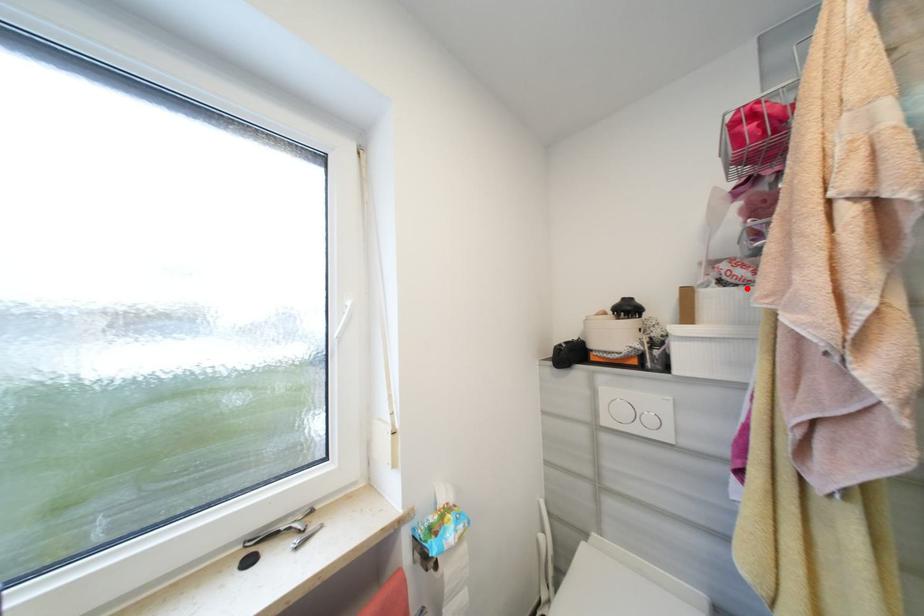
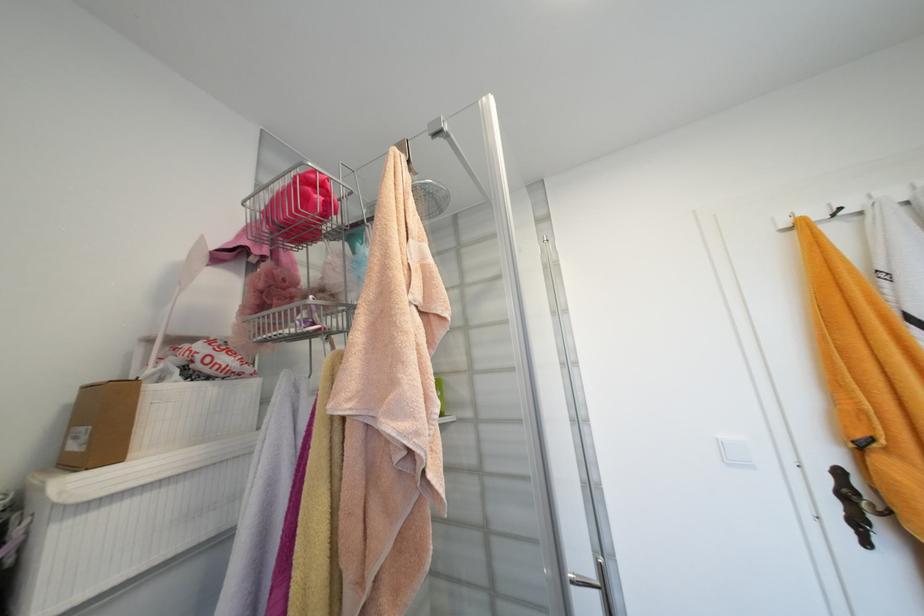
Question: I am providing you with two images of the same scene from different viewpoints. A red point is marked on the first image. Is the red point's position out of view in image 2?

Choices:
 (A) Yes
 (B) No

Answer: (B)